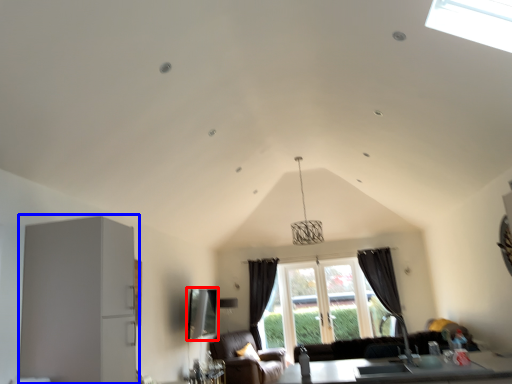
Question: Which object appears closest to the camera in this image, window screen (highlighted by a red box) or appliance (highlighted by a blue box)?

Choices:
 (A) window screen
 (B) appliance

Answer: (B)